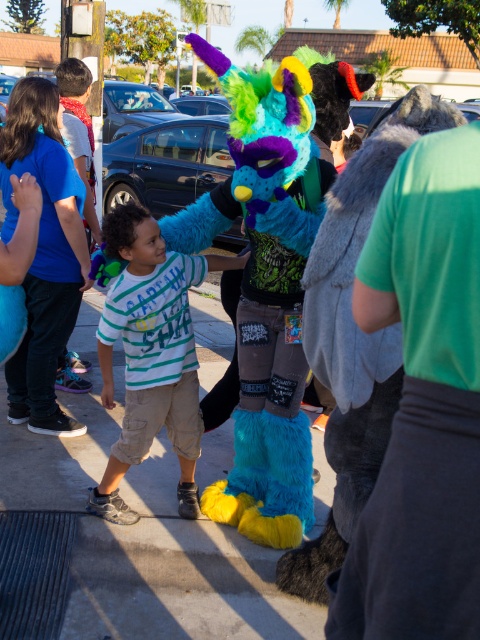
Between smooth concrete pavement at center and striped cotton shirt at center, which one is positioned higher?

striped cotton shirt at center

Which is more to the right, smooth concrete pavement at center or striped cotton shirt at center?

striped cotton shirt at center is more to the right.

Is point (56, 612) closer to viewer compared to point (197, 442)?

Yes, it is in front of point (197, 442).

The image size is (480, 640). I want to click on smooth concrete pavement at center, so click(136, 545).

Between fluffy blue and green monster at center and blue cotton shirt at left, which one is positioned lower?

fluffy blue and green monster at center is lower down.

What are the coordinates of `fluffy blue and green monster at center` in the screenshot? It's located at 264,291.

Can you confirm if smooth concrete pavement at center is taller than blue cotton shirt at upper left?

No, smooth concrete pavement at center is not taller than blue cotton shirt at upper left.

Is smooth concrete pavement at center behind blue cotton shirt at upper left?

No, smooth concrete pavement at center is closer to the viewer.

At what (x,y) coordinates should I click in order to perform the action: click on smooth concrete pavement at center. Please return your answer as a coordinate pair (x, y). Looking at the image, I should click on (136, 545).